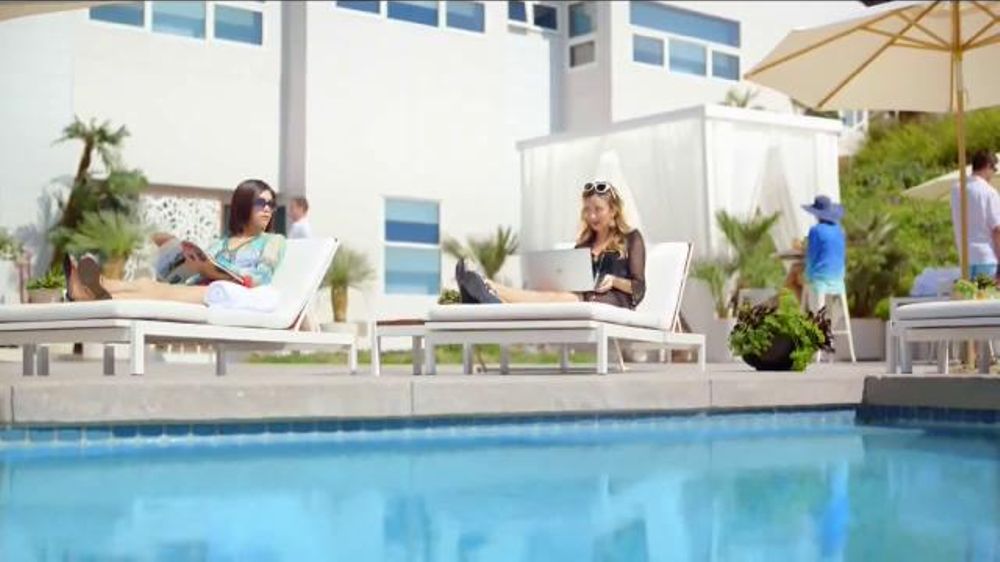
Locate an element on the screen. This screenshot has height=562, width=1000. sheer fabric is located at coordinates pyautogui.click(x=674, y=178), pyautogui.click(x=556, y=183), pyautogui.click(x=742, y=163), pyautogui.click(x=805, y=178).